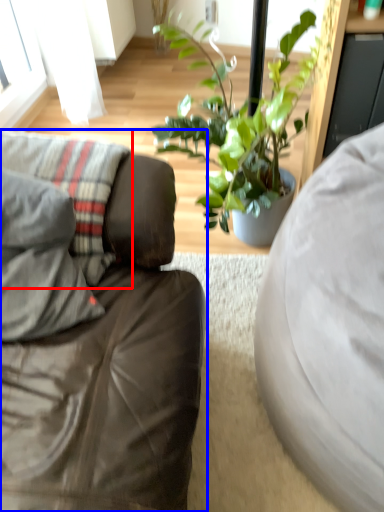
Question: Among these objects, which one is farthest to the camera, pillow (highlighted by a red box) or studio couch (highlighted by a blue box)?

Choices:
 (A) pillow
 (B) studio couch

Answer: (A)